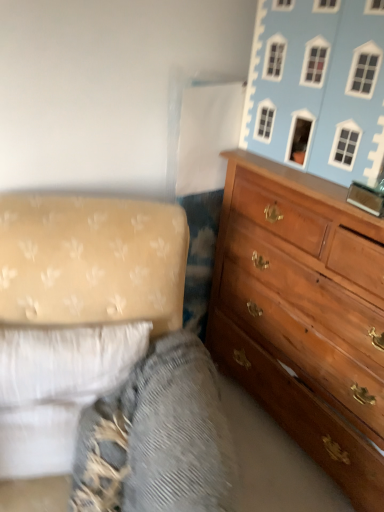
Question: From the image's perspective, is light blue painted wood dollhouse at upper right above or below textured fabric at lower left?

Choices:
 (A) above
 (B) below

Answer: (A)

Question: Is light blue painted wood dollhouse at upper right taller or shorter than textured fabric at lower left?

Choices:
 (A) short
 (B) tall

Answer: (B)

Question: Which of these objects is positioned farthest from the light blue painted wood dollhouse at upper right?

Choices:
 (A) white fabric studio couch at lower left
 (B) wooden dresser at right
 (C) textured fabric at lower left

Answer: (C)

Question: Which object is the farthest from the wooden dresser at right?

Choices:
 (A) light blue painted wood dollhouse at upper right
 (B) white fabric studio couch at lower left
 (C) textured fabric at lower left

Answer: (B)